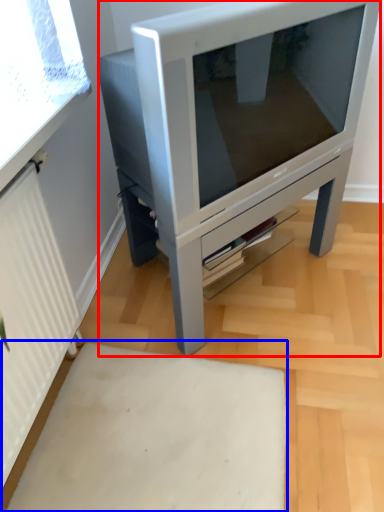
Question: Among these objects, which one is farthest to the camera, furniture (highlighted by a red box) or plain (highlighted by a blue box)?

Choices:
 (A) furniture
 (B) plain

Answer: (A)